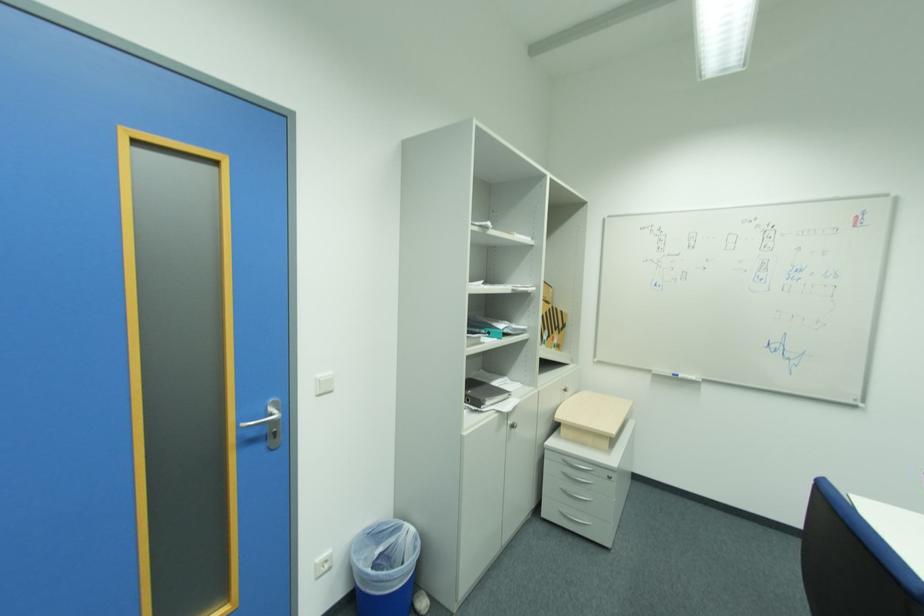
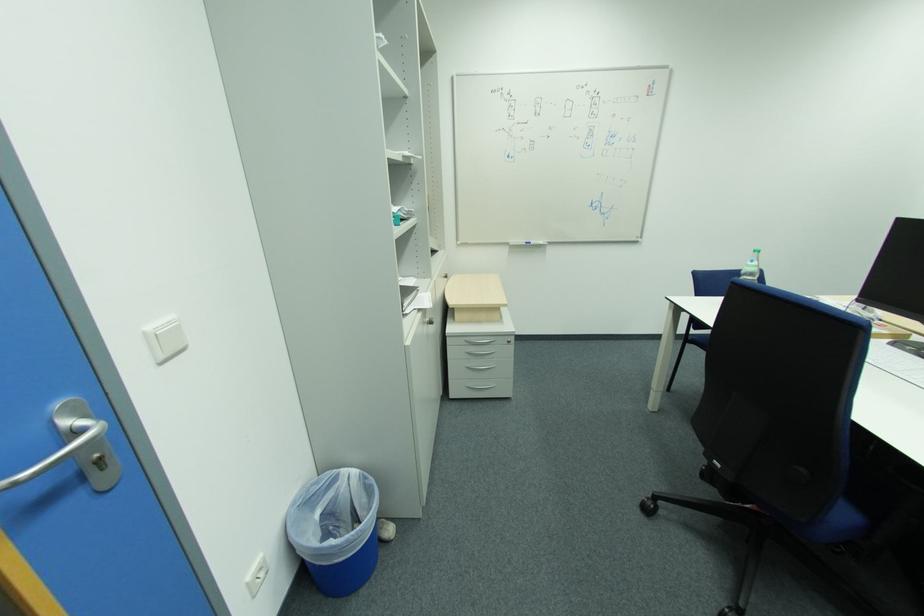
Locate, in the second image, the point that corresponds to (x=516, y=424) in the first image.

(433, 321)